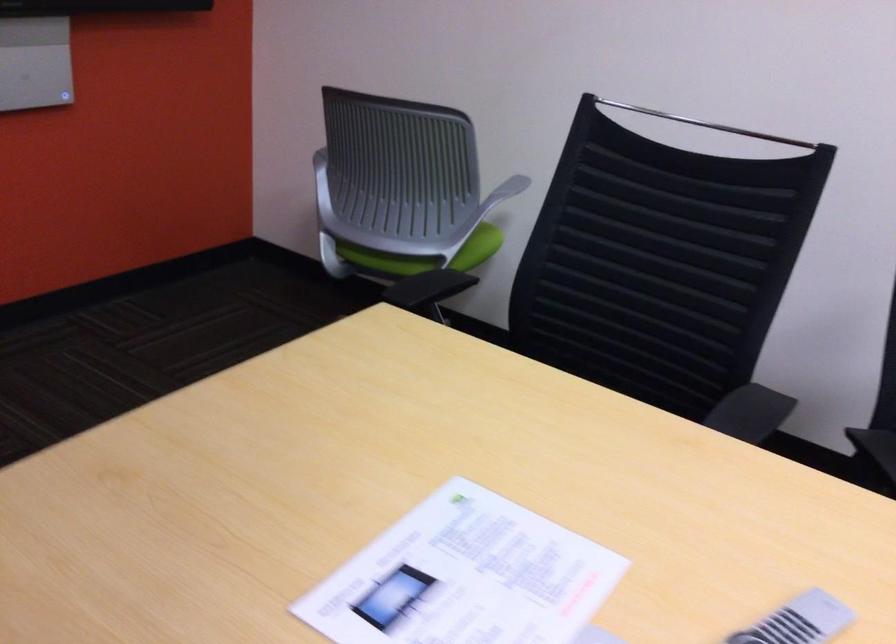
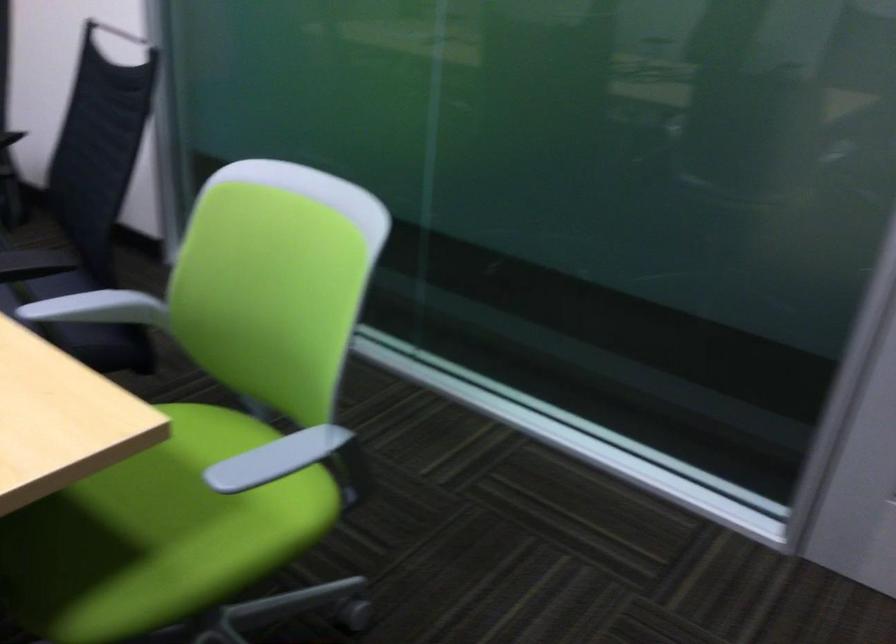
Question: In a continuous first-person perspective shot, in which direction is the camera moving?

Choices:
 (A) Left
 (B) Right
 (C) Forward
 (D) Backward

Answer: (B)